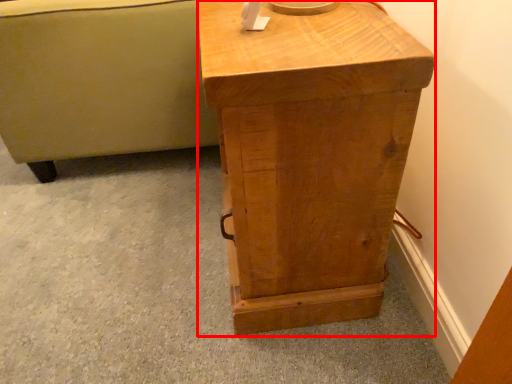
Question: Considering the relative positions of nightstand (annotated by the red box) and furniture in the image provided, where is nightstand (annotated by the red box) located with respect to the staircase?

Choices:
 (A) right
 (B) left

Answer: (A)